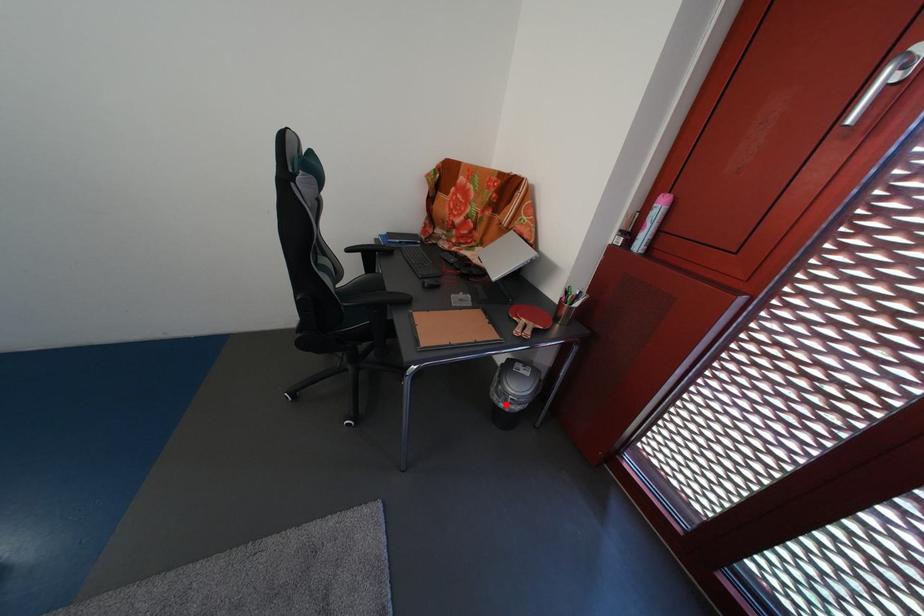
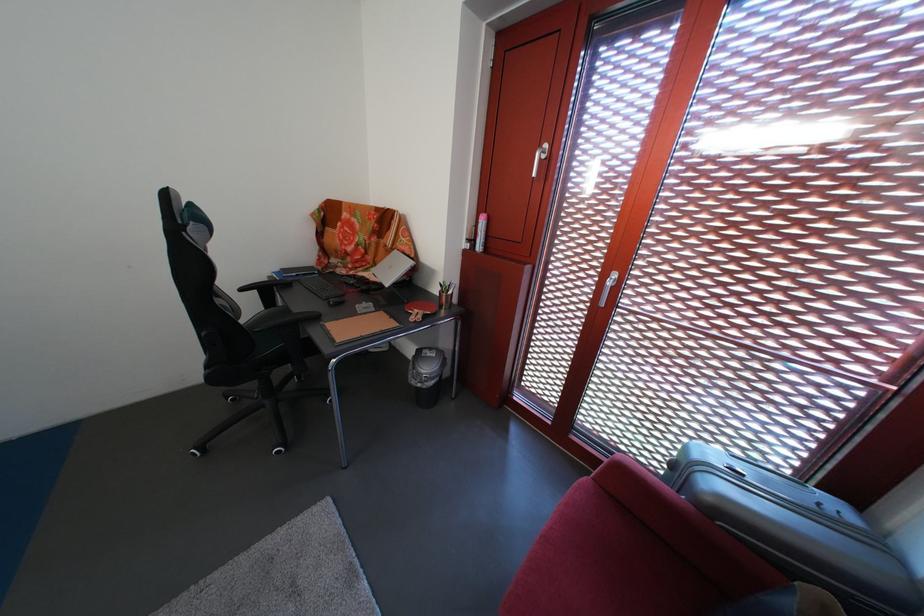
Locate, in the second image, the point that corresponds to the highlighted location in the first image.

(424, 389)